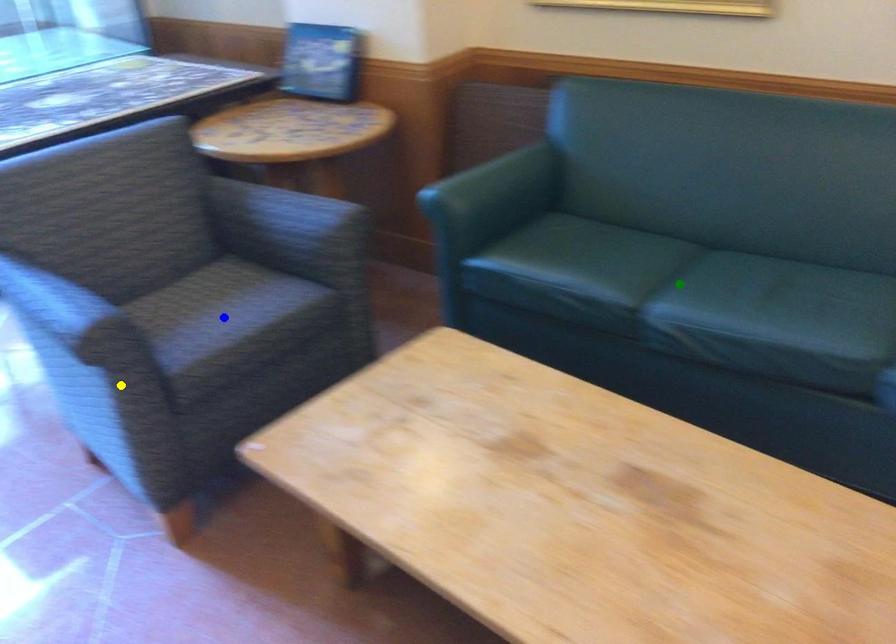
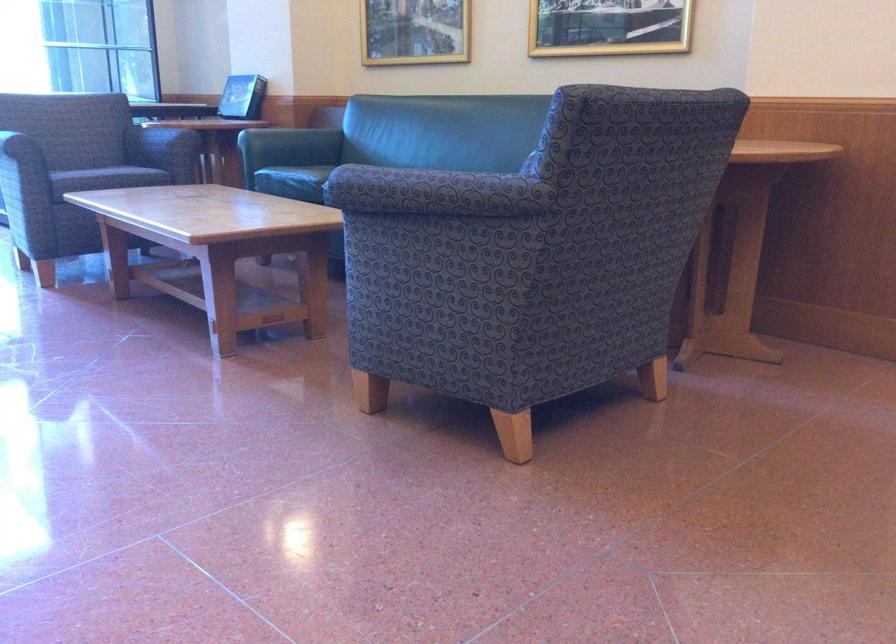
I am providing you with two images of the same scene from different viewpoints. Three points are marked in image1. Which point corresponds to a part or object that is occluded in image2?In image1, three points are marked. Which of them correspond to a part or object that is occluded in image2?Among the three points shown in image1, which one corresponds to a part or object that is no longer visible due to occlusion in image2?

Invisible in image2: blue point, green point.